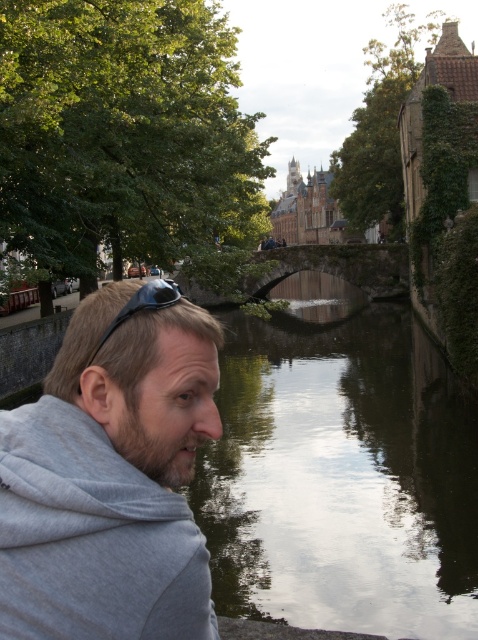
Based on the photo, is the position of greenish concrete canal at center less distant than that of gray cotton hoodie at left?

No, it is not.

What do you see at coordinates (340, 470) in the screenshot?
I see `greenish concrete canal at center` at bounding box center [340, 470].

Between point (262, 618) and point (186, 476), which one is positioned in front?

Point (186, 476)

Where is `greenish concrete canal at center`? greenish concrete canal at center is located at coordinates point(340,470).